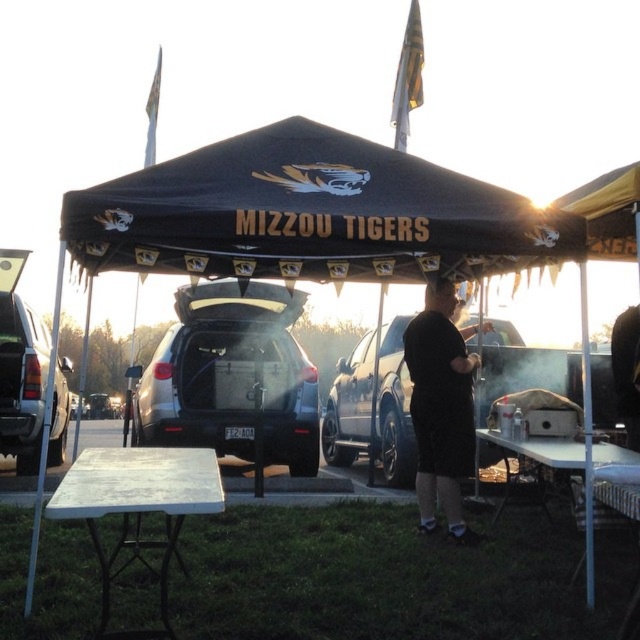
You are a photographer at the Mizzou Tigers tailgate event. You need to capture a photo that includes both the satin black car at center and the black matte shirt at center. Since the car is taller than the shirt, how should you position your camera to ensure both are fully visible in the frame?

To include both the satin black car at center and the black matte shirt at center in the photo, position the camera at a lower angle so that the taller car doesn not block the view of the shirt. This way, both objects will be fully visible in the frame.

You are planning to set up a small table between the satin black car at center and the black matte shirt at center. Based on their positions, which object should the table be placed closer to?

The satin black car at center is positioned on the left side of the black matte shirt at center, so the table should be placed closer to the satin black car at center to maintain symmetry between the two objects.